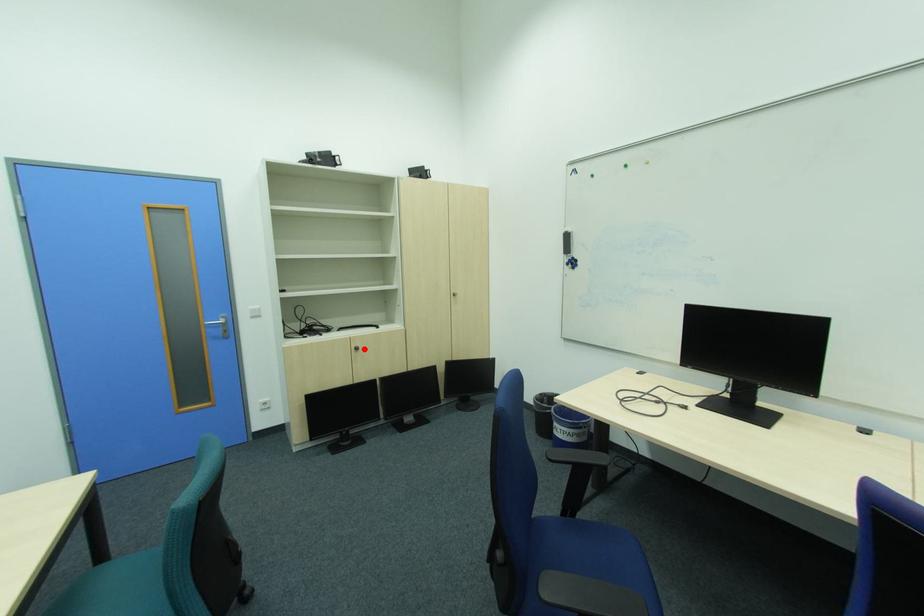
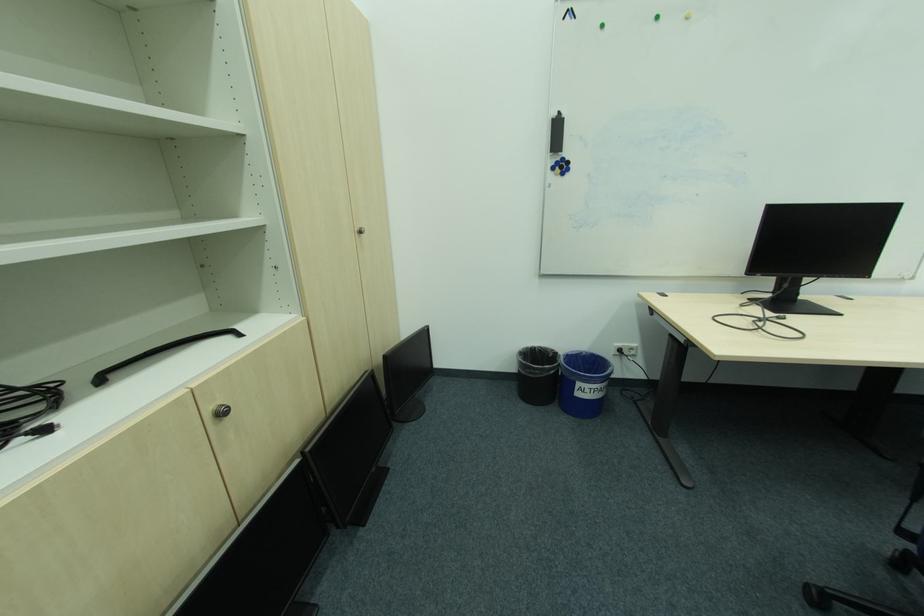
Where in the second image is the point corresponding to the highlighted location from the first image?

(227, 415)